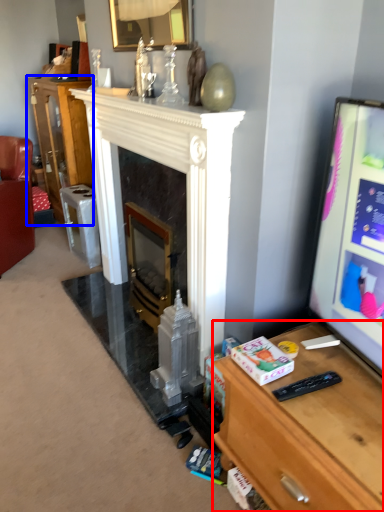
Question: Which point is further to the camera, desk (highlighted by a red box) or cabinetry (highlighted by a blue box)?

Choices:
 (A) desk
 (B) cabinetry

Answer: (B)